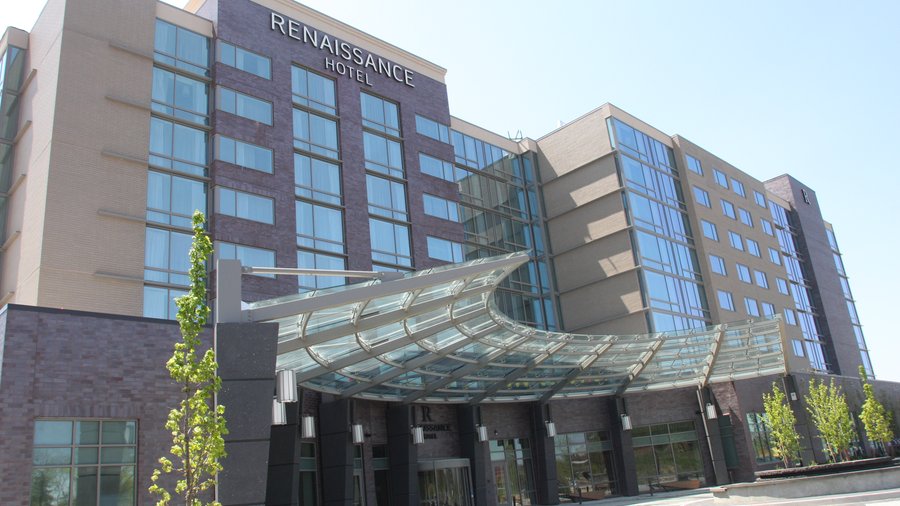
This screenshot has width=900, height=506. What are the coordinates of `doors` in the screenshot? It's located at (446, 471).